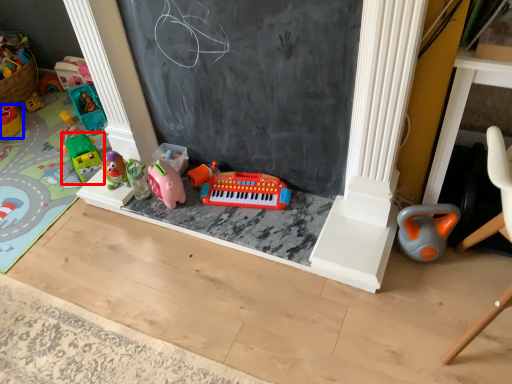
Question: Which object appears farthest to the camera in this image, toy (highlighted by a red box) or toy (highlighted by a blue box)?

Choices:
 (A) toy
 (B) toy

Answer: (B)